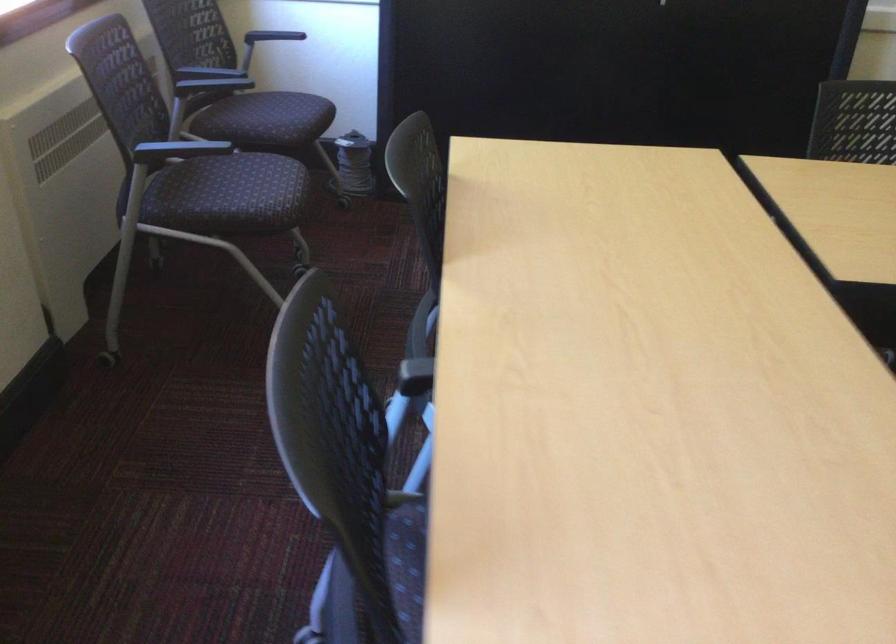
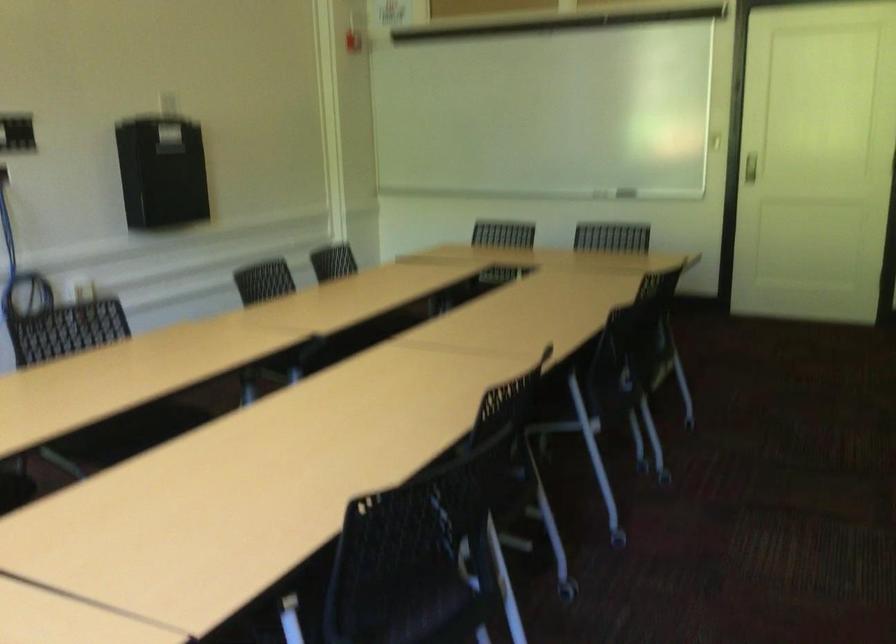
Question: The first image is from the beginning of the video and the second image is from the end. How did the camera likely rotate when shooting the video?

Choices:
 (A) Left
 (B) Right
 (C) Up
 (D) Down

Answer: (B)